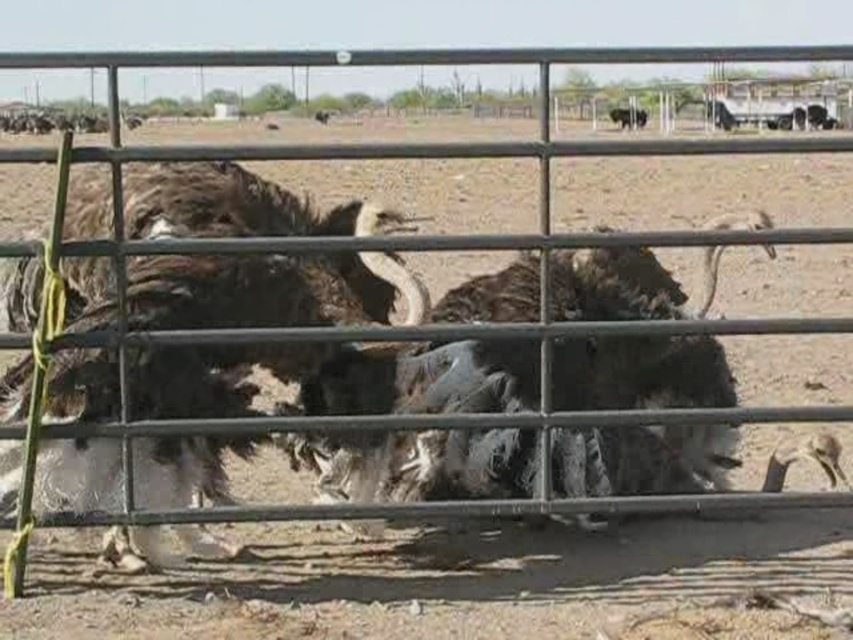
You are a visitor at the farm and see the shiny black car at upper right and the brown fuzzy bison at upper right. Which object is positioned more to the right side of the image?

The shiny black car at upper right is positioned more to the right side of the image than the brown fuzzy bison at upper right.

You are a farmer who needs to move the shiny black car at upper right to the barn located behind the fuzzy brown bison at center. Given that the distance between them is 23.30 meters, will you have enough space to maneuver the car around the fence and reach the barn?

The distance between the fuzzy brown bison at center and the shiny black car at upper right is 23.30 meters. Since the car needs to maneuver around the fence, this distance should be sufficient for the farmer to move the car to the barn as long as there are no other obstacles in the path.

You are a farmer checking the fence. You notice a point marked at coordinates (x=268, y=291). What is located at that point?

The point at coordinates (x=268, y=291) indicates the location of the fuzzy brown bison at center.